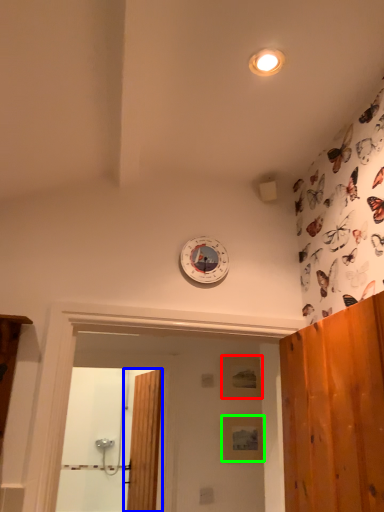
Question: Which object is the farthest from panel (highlighted by a red box)? Choose among these: door (highlighted by a blue box) or panel (highlighted by a green box).

Choices:
 (A) door
 (B) panel

Answer: (A)